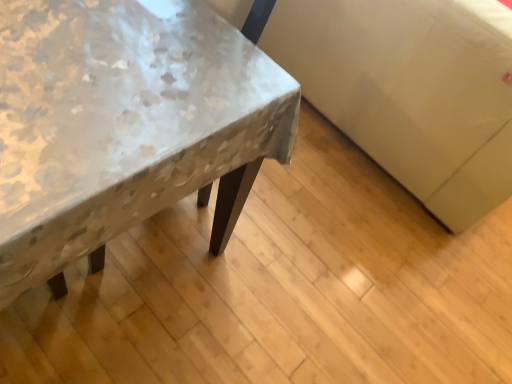
What do you see at coordinates (125, 126) in the screenshot? I see `floral-patterned fabric-covered table at left` at bounding box center [125, 126].

I want to click on floral-patterned fabric-covered table at left, so click(125, 126).

Find the location of a particular element. The image size is (512, 384). floral-patterned fabric-covered table at left is located at coordinates (125, 126).